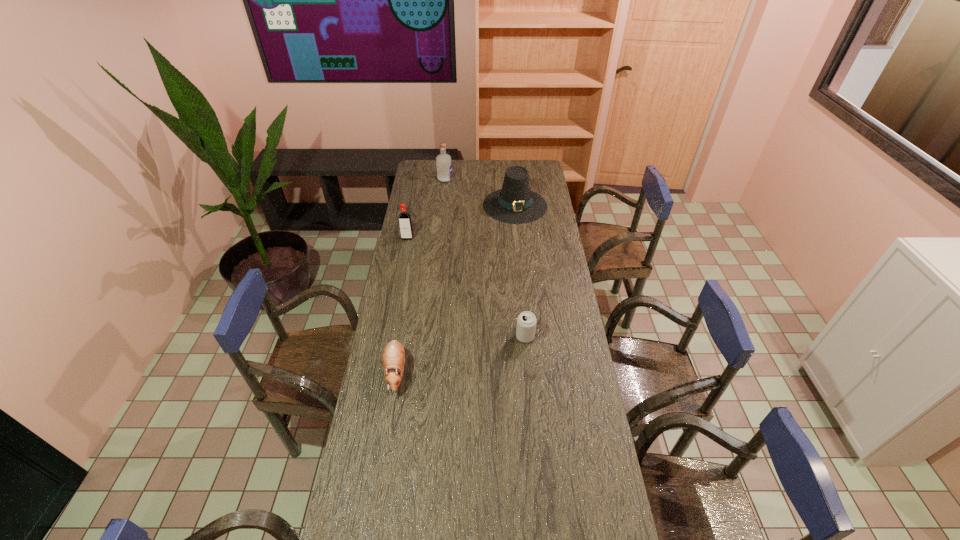
Find the location of a particular element. the farthest object is located at coordinates (443, 161).

At what (x,y) coordinates should I click in order to perform the action: click on the right vodka. Please return your answer as a coordinate pair (x, y). The height and width of the screenshot is (540, 960). Looking at the image, I should click on (443, 161).

In order to click on the second farthest object in this screenshot , I will do `click(515, 204)`.

Identify the location of the nearer vodka. (405, 223).

Find the location of a particular element. the third farthest object is located at coordinates (405, 223).

Where is `the second nearest object`? the second nearest object is located at coordinates (526, 322).

Find the location of a particular element. This screenshot has height=540, width=960. the nearest object is located at coordinates (393, 357).

Where is `vacant area situated on the label of the third object from left to right`? vacant area situated on the label of the third object from left to right is located at coordinates (496, 179).

You are a GUI agent. You are given a task and a screenshot of the screen. Output one action in this format:
    pyautogui.click(x=<x>, y=<y>)
    Task: Click on the free region located on the front-facing side of the hat
    The image size is (960, 540).
    Given the screenshot: What is the action you would take?
    pyautogui.click(x=520, y=257)

At what (x,y) coordinates should I click in order to perform the action: click on free spot located 0.240m on the front and back of the third nearest object. Please return your answer as a coordinate pair (x, y). The width and height of the screenshot is (960, 540). Looking at the image, I should click on pyautogui.click(x=400, y=274).